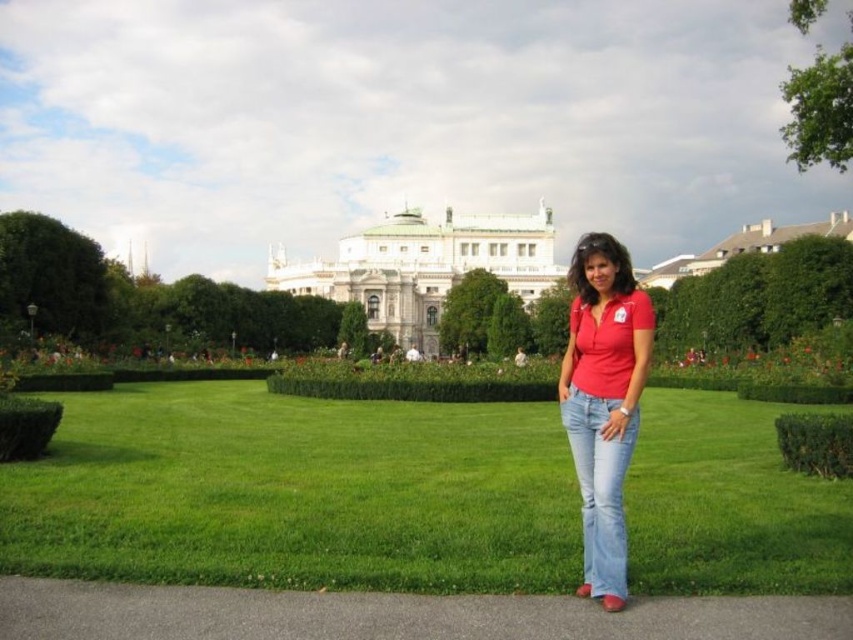
Does matte red shirt at center have a greater height compared to white stone building at center?

Indeed, matte red shirt at center has a greater height compared to white stone building at center.

Does point (630, 310) come in front of point (517, 266)?

Yes.

This screenshot has height=640, width=853. I want to click on matte red shirt at center, so click(602, 401).

Looking at this image, measure the distance between matte red shirt at center and camera.

matte red shirt at center and camera are 74.99 meters apart from each other.

What are the coordinates of `matte red shirt at center` in the screenshot? It's located at (602, 401).

Is green grass at center bigger than green leafy hedge at upper right?

Indeed, green grass at center has a larger size compared to green leafy hedge at upper right.

Find the location of a particular element. This screenshot has width=853, height=640. green grass at center is located at coordinates 296,492.

Image resolution: width=853 pixels, height=640 pixels. I want to click on green grass at center, so click(x=296, y=492).